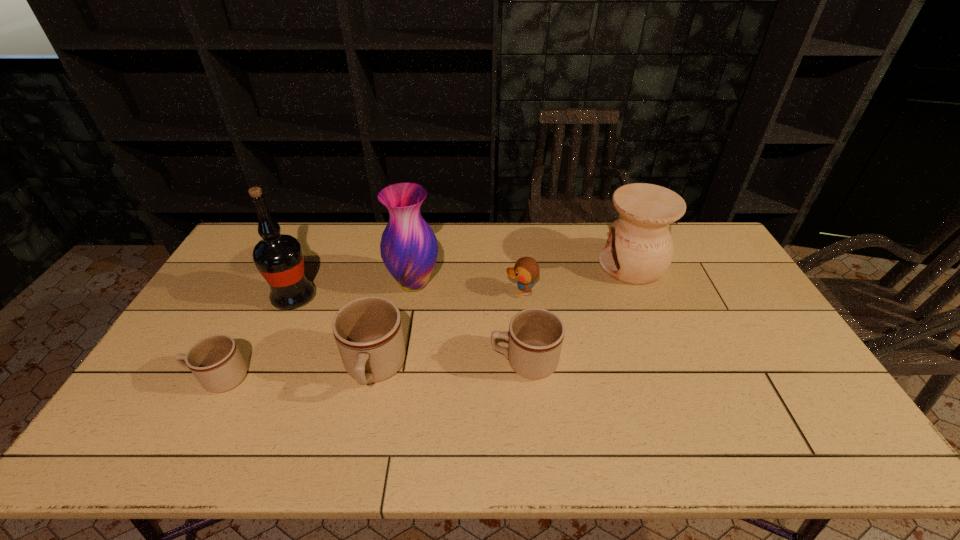
Locate an element on the screen. The width and height of the screenshot is (960, 540). free space located at the open side of the rightmost object is located at coordinates (582, 265).

Find the location of a particular element. The height and width of the screenshot is (540, 960). vacant space located 0.220m at the open side of the rightmost object is located at coordinates (535, 265).

Where is `object located at the far edge`? The height and width of the screenshot is (540, 960). object located at the far edge is located at coordinates (639, 250).

The height and width of the screenshot is (540, 960). I want to click on object present at the left edge, so click(216, 362).

This screenshot has height=540, width=960. What are the coordinates of `object that is positioned at the near left corner` in the screenshot? It's located at (216, 362).

I want to click on free spot at the far edge of the desktop, so click(481, 242).

Image resolution: width=960 pixels, height=540 pixels. What are the coordinates of `free space at the near edge of the desktop` in the screenshot? It's located at (465, 394).

Where is `vacant point at the left edge`? The height and width of the screenshot is (540, 960). vacant point at the left edge is located at coordinates (233, 295).

Locate an element on the screen. This screenshot has width=960, height=540. vacant space at the right edge is located at coordinates (752, 314).

The image size is (960, 540). Find the location of `free area in between the shortest mug and the vase`. free area in between the shortest mug and the vase is located at coordinates (317, 330).